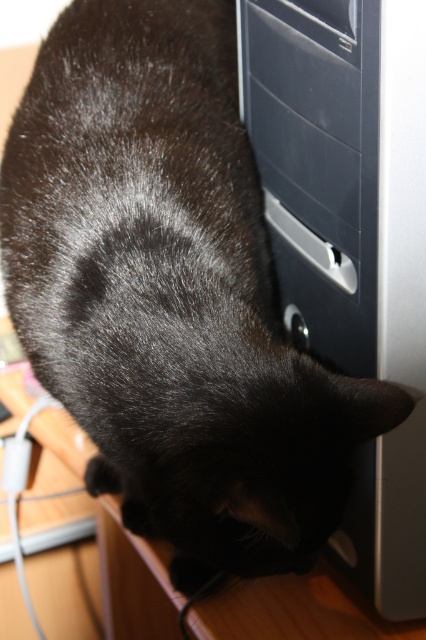
In the scene shown: How far apart are satin silver computer tower at center and satin black drawer at center?

10.65 centimeters

Does satin silver computer tower at center appear under satin black drawer at center?

Correct, satin silver computer tower at center is located below satin black drawer at center.

This screenshot has height=640, width=426. Identify the location of satin silver computer tower at center. (351, 237).

Find the location of `satin silver computer tower at center`. satin silver computer tower at center is located at coordinates (351, 237).